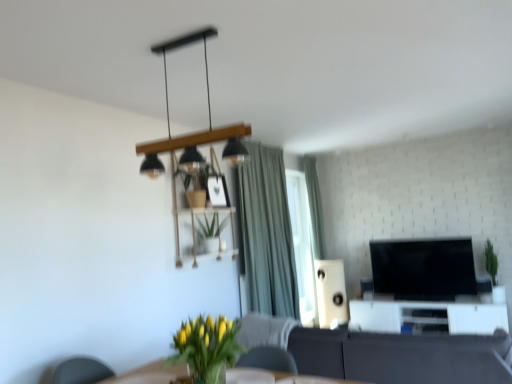
Question: Relative to matte black pendant light at upper center, is black glossy tv at center right in front or behind?

Choices:
 (A) front
 (B) behind

Answer: (B)

Question: Would you say black glossy tv at center right is inside or outside matte black pendant light at upper center?

Choices:
 (A) inside
 (B) outside

Answer: (B)

Question: Which object is the farthest from the black glossy tv at center right?

Choices:
 (A) white glossy entertainment center at lower right
 (B) dark gray fabric couch at center
 (C) green fabric curtain at upper center
 (D) green matte plant at right
 (E) green matte plant at center, marked as the second houseplant in a front-to-back arrangement

Answer: (B)

Question: Based on their relative distances, which object is farther from the black glossy tv at center right?

Choices:
 (A) white matte speaker at center-right
 (B) green fabric curtain at upper center
 (C) green matte plant at center, marked as the second houseplant in a front-to-back arrangement
 (D) matte black pendant light at upper center
 (E) yellow-green leafy plant at lower center, which is the 2th houseplant from back to front

Answer: (E)